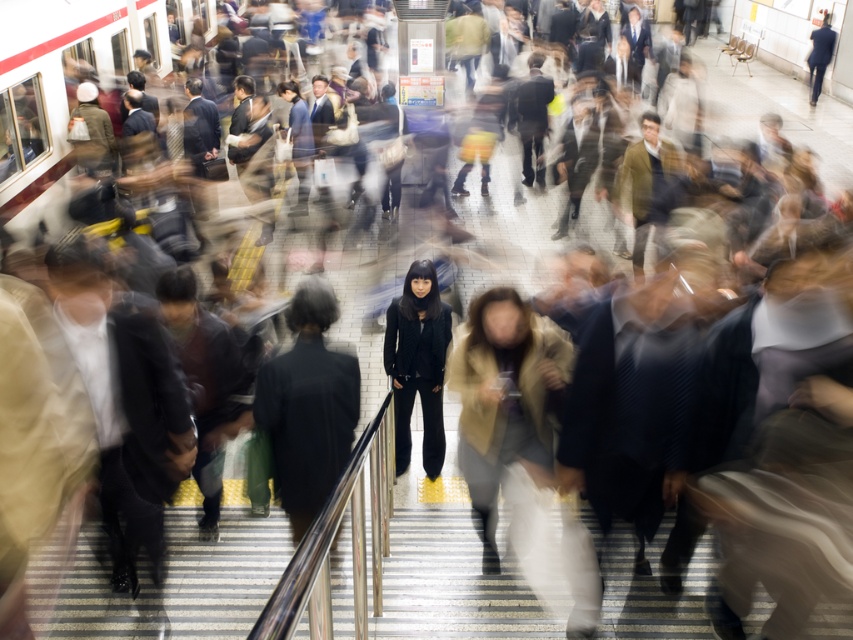
Is dark gray fabric jacket at center bigger than black matte pants at center?

Actually, dark gray fabric jacket at center might be smaller than black matte pants at center.

Does dark gray fabric jacket at center have a lesser width compared to black matte pants at center?

Incorrect, dark gray fabric jacket at center's width is not less than black matte pants at center's.

Measure the distance between point (310,376) and camera.

The distance of point (310,376) from camera is 3.97 meters.

Locate an element on the screen. The height and width of the screenshot is (640, 853). dark gray fabric jacket at center is located at coordinates (306, 406).